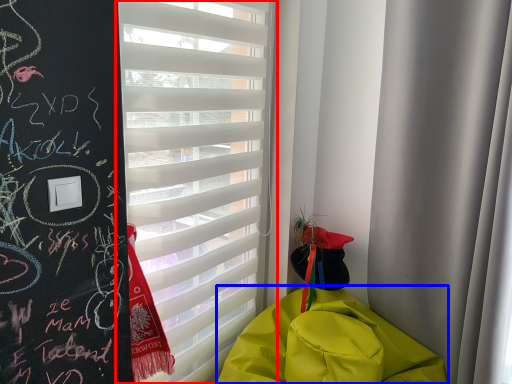
Question: Which of the following is the farthest to the observer, window blind (highlighted by a red box) or blanket (highlighted by a blue box)?

Choices:
 (A) window blind
 (B) blanket

Answer: (A)